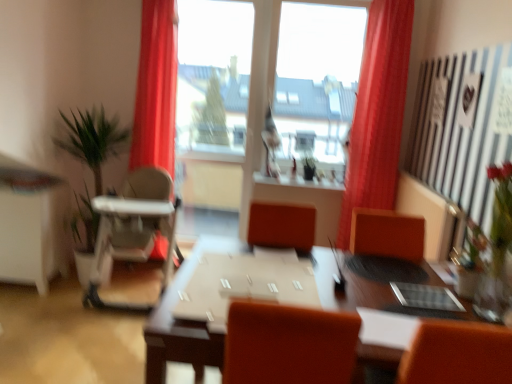
This screenshot has width=512, height=384. I want to click on vacant area on top of brown wooden table at center (from a real-world perspective), so click(340, 280).